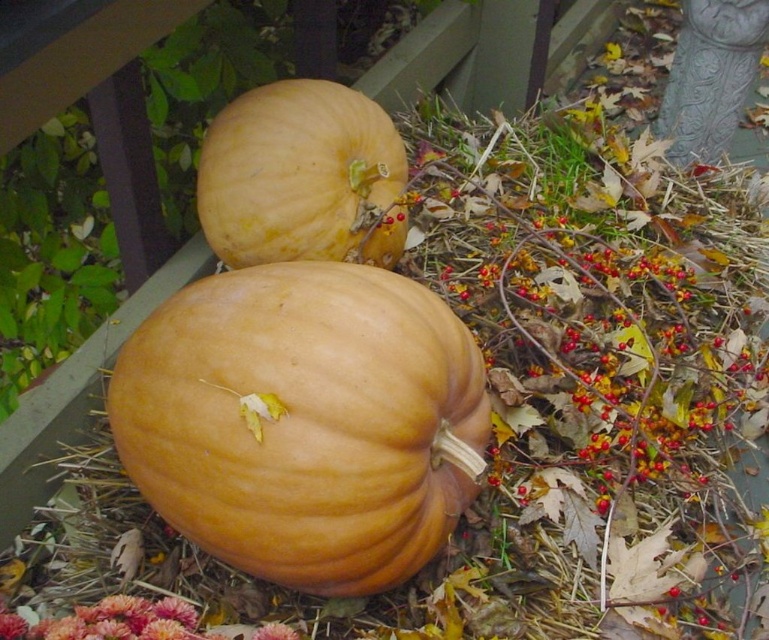
You are a delivery robot with a 10 inch wide package. You need to place the package between the matte orange pumpkin at center and the matte orange pumpkin at upper center. Is there enough space between them to fit the package?

The distance between the matte orange pumpkin at center and the matte orange pumpkin at upper center is 12.07 inches, which is wider than the 10 inch package. Therefore, the package can be placed between them.

You are standing in front of a wooden deck with two matte orange pumpkins. The pumpkins are labeled as the matte orange pumpkin at center and the matte orange pumpkin at upper center. Which pumpkin is positioned lower on the deck?

The matte orange pumpkin at center is positioned lower on the deck because it is located below the matte orange pumpkin at upper center.